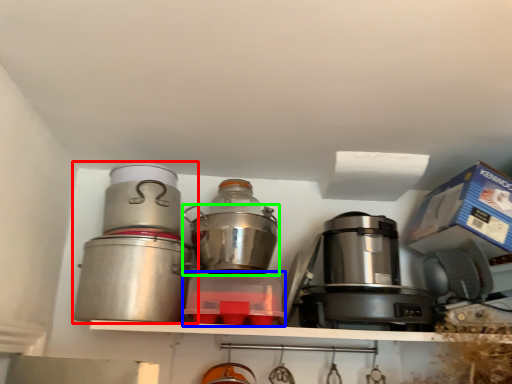
Question: Considering the real-world distances, which object is closest to kitchen appliance (highlighted by a red box)? kitchen appliance (highlighted by a blue box) or kitchen appliance (highlighted by a green box).

Choices:
 (A) kitchen appliance
 (B) kitchen appliance

Answer: (B)